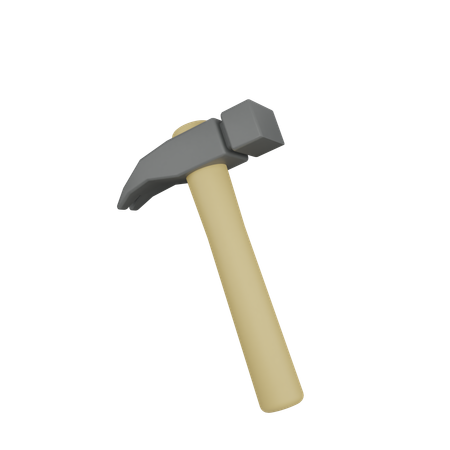
You are a GUI agent. You are given a task and a screenshot of the screen. Output one action in this format:
    pyautogui.click(x=<x>, y=<y>)
    Task: Click on the handle
    
    Given the screenshot: What is the action you would take?
    pyautogui.click(x=261, y=360)